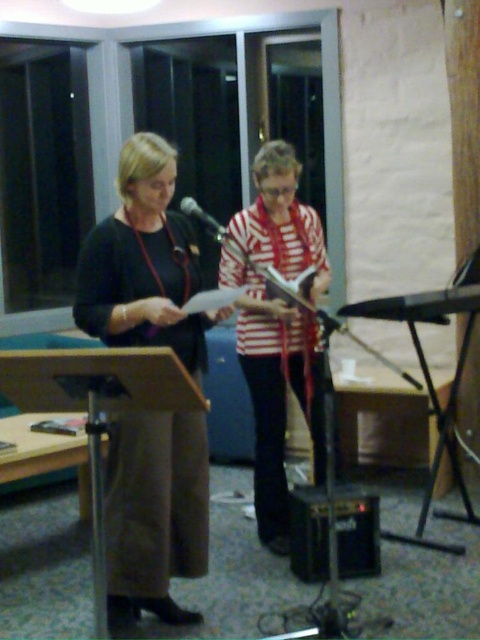
Which is above, striped fabric at center or black matte microphone at center?

black matte microphone at center

Can you confirm if striped fabric at center is positioned to the left of black matte microphone at center?

In fact, striped fabric at center is to the right of black matte microphone at center.

Identify the location of striped fabric at center. The height and width of the screenshot is (640, 480). (276, 390).

Find the location of a particular element. striped fabric at center is located at coordinates (276, 390).

Between point (83, 321) and point (245, 227), which one is positioned in front?

Point (83, 321)

Which of these two, matte black dress at center or striped fabric at center, stands taller?

striped fabric at center

You are a GUI agent. You are given a task and a screenshot of the screen. Output one action in this format:
    pyautogui.click(x=<x>, y=<y>)
    Task: Click on the matte black dress at center
    This screenshot has width=480, height=640.
    Given the screenshot: What is the action you would take?
    pyautogui.click(x=144, y=262)

In the scene shown: Does matte black dress at center have a lesser width compared to black matte microphone at center?

No.

Does matte black dress at center have a greater width compared to black matte microphone at center?

Yes.

Is point (165, 332) positioned before point (212, 230)?

That is True.

Locate an element on the screen. The width and height of the screenshot is (480, 640). matte black dress at center is located at coordinates (144, 262).